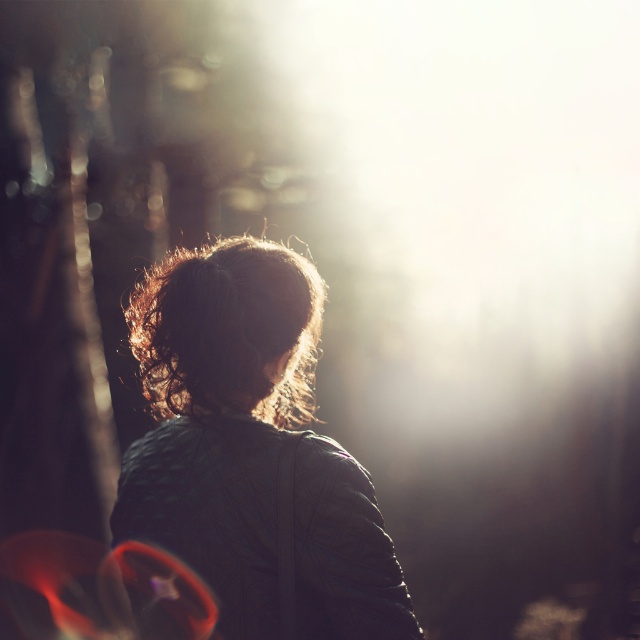
You are a GUI agent. You are given a task and a screenshot of the screen. Output one action in this format:
    pyautogui.click(x=<x>, y=<y>)
    Task: Click on the matte black jacket at center
    The image size is (640, 640).
    Given the screenshot: What is the action you would take?
    pyautogui.click(x=220, y=413)

Can you confirm if matte black jacket at center is positioned to the right of curly brown hair at center?

Yes, matte black jacket at center is to the right of curly brown hair at center.

Who is more distant from viewer, (364,580) or (161,321)?

Point (161,321)

The height and width of the screenshot is (640, 640). Identify the location of matte black jacket at center. (220, 413).